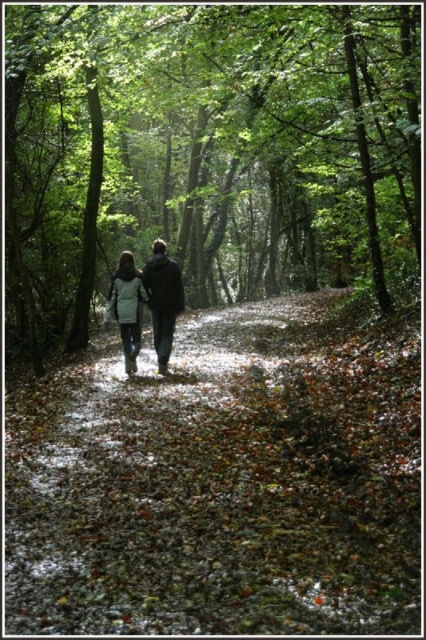
You are a hiker trying to decide whether to walk on the brown leafy forest path at center or stay under the green leafy tree at center for shade. Which option provides more coverage from the sun?

The green leafy tree at center is larger than the brown leafy forest path at center, so staying under the green leafy tree at center would provide more shade coverage from the sun.

Looking at this image, you are a hiker who wants to take a photo of the white wool coat at center while standing on the brown leafy forest path at center. Since the path is bigger than the coat, will you be able to stand entirely on the path while taking the photo?

Yes, the brown leafy forest path at center is bigger than the white wool coat at center, so you can stand entirely on the path while taking the photo.

You are standing on the brown leafy forest path at center and want to reach the green leafy tree at center. Which direction should you move to get closer to the tree?

Since the brown leafy forest path at center is closer to the viewer than the green leafy tree at center, you should move forward along the path to get closer to the tree.